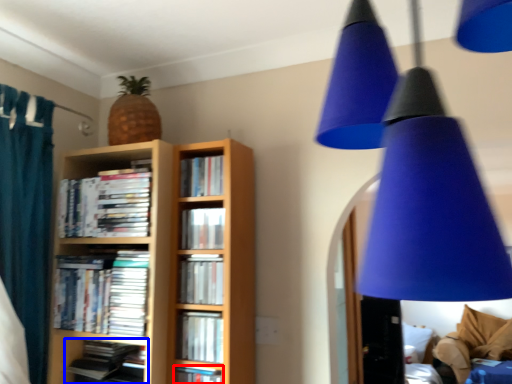
Question: Which of the following is the farthest to the observer, book (highlighted by a red box) or book (highlighted by a blue box)?

Choices:
 (A) book
 (B) book

Answer: (B)